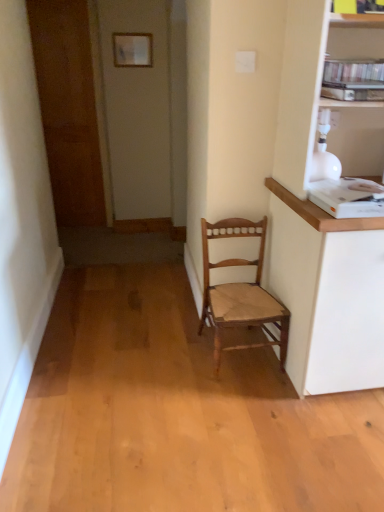
Question: From the image's perspective, relative to brown wooden door at left, is white paper at upper center above or below?

Choices:
 (A) above
 (B) below

Answer: (A)

Question: Which is correct: white paper at upper center is inside brown wooden door at left, or outside of it?

Choices:
 (A) outside
 (B) inside

Answer: (A)

Question: Estimate the real-world distances between objects in this image. Which object is closer to the white plastic printer at upper right?

Choices:
 (A) white paper at upper center
 (B) wooden chair at center
 (C) brown wooden door at left

Answer: (B)

Question: Which object is positioned closest to the wooden chair at center?

Choices:
 (A) white paper at upper center
 (B) brown wooden door at left
 (C) white plastic printer at upper right

Answer: (C)